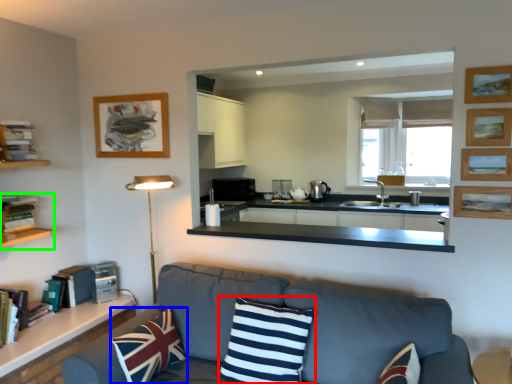
Question: Considering the real-world distances, which object is closest to pillow (highlighted by a red box)? pillow (highlighted by a blue box) or shelf (highlighted by a green box).

Choices:
 (A) pillow
 (B) shelf

Answer: (A)